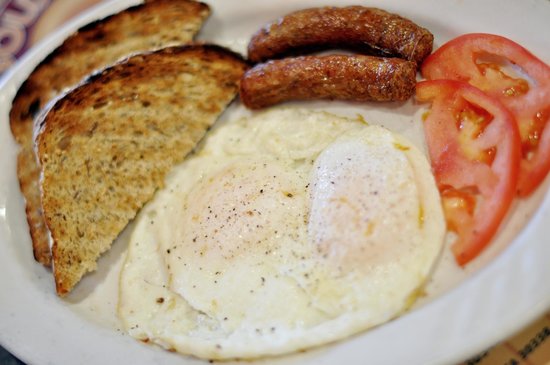
Where is `table`? table is located at coordinates (527, 354), (47, 18).